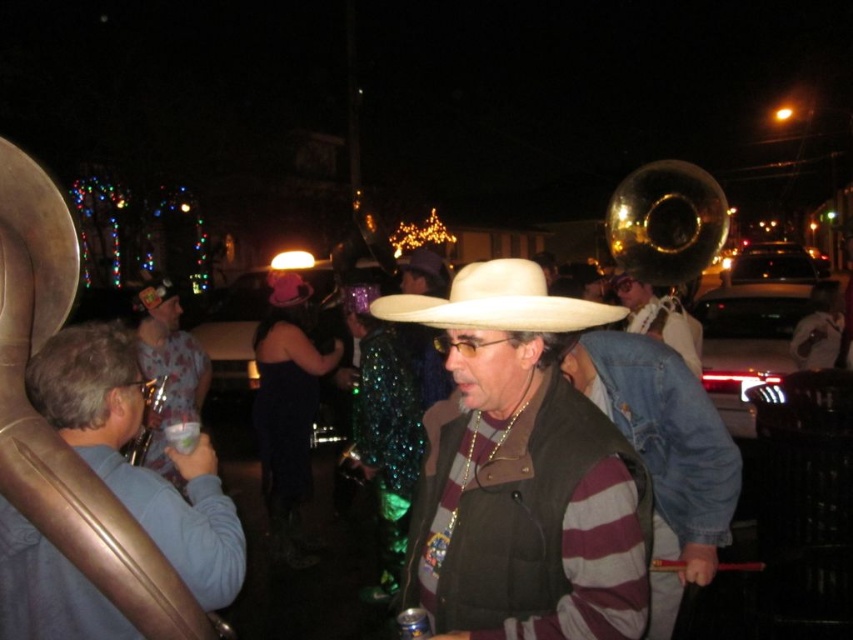
Is blue fabric shirt at left thinner than matte white cowboy hat at center?

Incorrect, blue fabric shirt at left's width is not less than matte white cowboy hat at center's.

Between point (61, 394) and point (270, 288), which one is positioned behind?

The point (270, 288) is more distant.

At what (x,y) coordinates should I click in order to perform the action: click on blue fabric shirt at left. Please return your answer as a coordinate pair (x, y). Looking at the image, I should click on (138, 467).

Based on the photo, between blue fabric shirt at left and striped sweater at center, which one is positioned higher?

blue fabric shirt at left is higher up.

Can you confirm if blue fabric shirt at left is thinner than striped sweater at center?

In fact, blue fabric shirt at left might be wider than striped sweater at center.

You are a GUI agent. You are given a task and a screenshot of the screen. Output one action in this format:
    pyautogui.click(x=<x>, y=<y>)
    Task: Click on the blue fabric shirt at left
    Image resolution: width=853 pixels, height=640 pixels.
    Given the screenshot: What is the action you would take?
    pyautogui.click(x=138, y=467)

How far apart are white felt fedora at center and brushed metal saxophone at left?

A distance of 6.85 feet exists between white felt fedora at center and brushed metal saxophone at left.

Which is more to the left, white felt fedora at center or brushed metal saxophone at left?

From the viewer's perspective, brushed metal saxophone at left appears more on the left side.

Between point (543, 308) and point (181, 365), which one is positioned behind?

The point (181, 365) is behind.

Image resolution: width=853 pixels, height=640 pixels. I want to click on white felt fedora at center, so click(x=497, y=301).